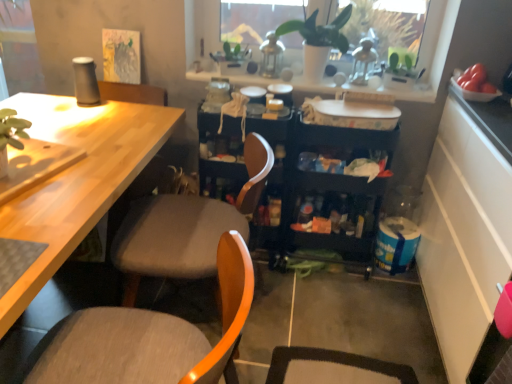
Question: Is black plastic storage cart at center completely or partially outside of wooden chair at center, which appears as the second chair when viewed from the back?

Choices:
 (A) no
 (B) yes

Answer: (B)

Question: Can you confirm if black plastic storage cart at center is positioned to the right of wooden chair at center, which appears as the second chair when viewed from the back?

Choices:
 (A) no
 (B) yes

Answer: (B)

Question: Considering the relative sizes of black plastic storage cart at center and wooden chair at center, placed as the 1th chair when sorted from front to back, in the image provided, is black plastic storage cart at center wider than wooden chair at center, placed as the 1th chair when sorted from front to back,?

Choices:
 (A) yes
 (B) no

Answer: (B)

Question: Can you confirm if black plastic storage cart at center is taller than wooden chair at center, which appears as the second chair when viewed from the back?

Choices:
 (A) yes
 (B) no

Answer: (A)

Question: Is the depth of black plastic storage cart at center less than that of wooden chair at center, placed as the 1th chair when sorted from front to back?

Choices:
 (A) yes
 (B) no

Answer: (B)

Question: From a real-world perspective, is black plastic storage cart at center positioned over wooden chair at center, placed as the 1th chair when sorted from front to back, based on gravity?

Choices:
 (A) yes
 (B) no

Answer: (B)

Question: Is there a large distance between light wood desk at left and fabric cushioned chair at center, the 1th chair from the back?

Choices:
 (A) no
 (B) yes

Answer: (A)

Question: From a real-world perspective, does light wood desk at left stand above fabric cushioned chair at center, the 1th chair from the back?

Choices:
 (A) no
 (B) yes

Answer: (B)

Question: Can you confirm if light wood desk at left is smaller than fabric cushioned chair at center, the 1th chair from the back?

Choices:
 (A) yes
 (B) no

Answer: (B)

Question: Considering the relative positions of light wood desk at left and fabric cushioned chair at center, positioned as the 2th chair in front-to-back order, in the image provided, is light wood desk at left to the right of fabric cushioned chair at center, positioned as the 2th chair in front-to-back order, from the viewer's perspective?

Choices:
 (A) yes
 (B) no

Answer: (B)

Question: Is light wood desk at left positioned in front of fabric cushioned chair at center, positioned as the 2th chair in front-to-back order?

Choices:
 (A) yes
 (B) no

Answer: (B)

Question: Is light wood desk at left facing towards fabric cushioned chair at center, the 1th chair from the back?

Choices:
 (A) no
 (B) yes

Answer: (A)

Question: Is black plastic storage cart at center with white textured tray at upper center?

Choices:
 (A) no
 (B) yes

Answer: (A)